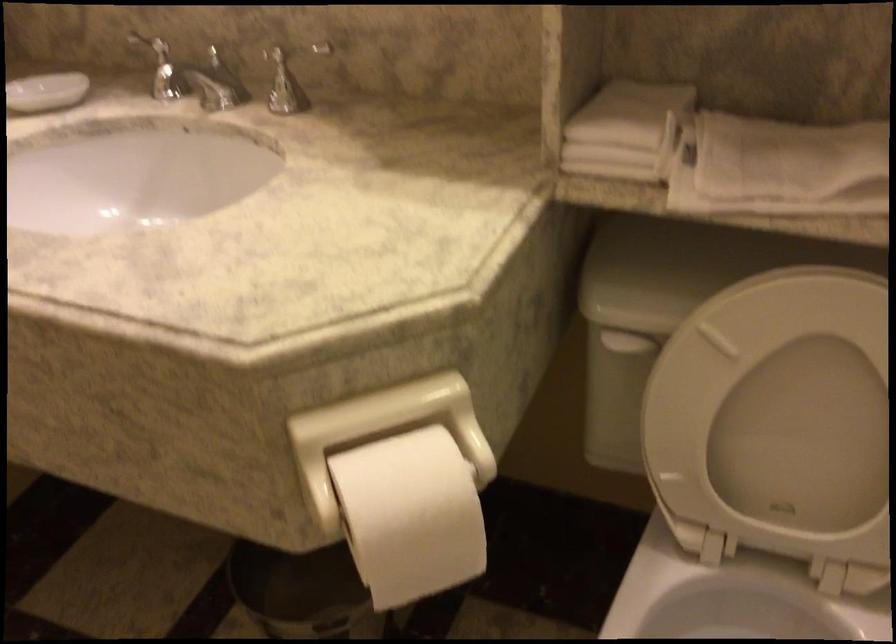
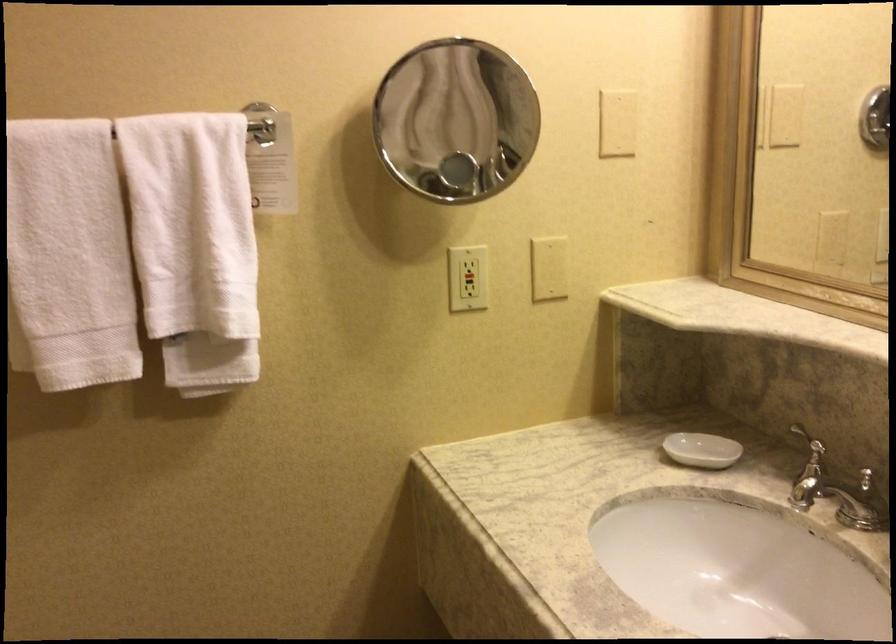
Question: The camera is either moving clockwise (left) or counter-clockwise (right) around the object. The first image is from the beginning of the video and the second image is from the end. Is the camera moving left or right when shooting the video?

Choices:
 (A) Left
 (B) Right

Answer: (B)